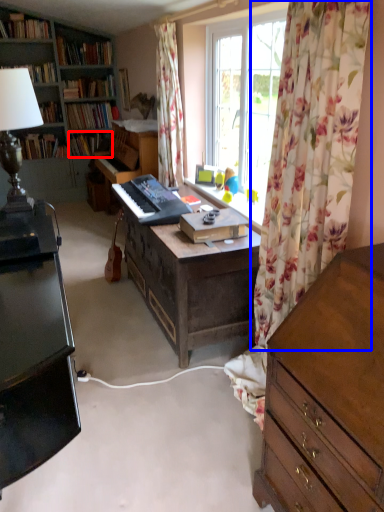
Question: Which object is further to the camera taking this photo, book (highlighted by a red box) or curtain (highlighted by a blue box)?

Choices:
 (A) book
 (B) curtain

Answer: (A)